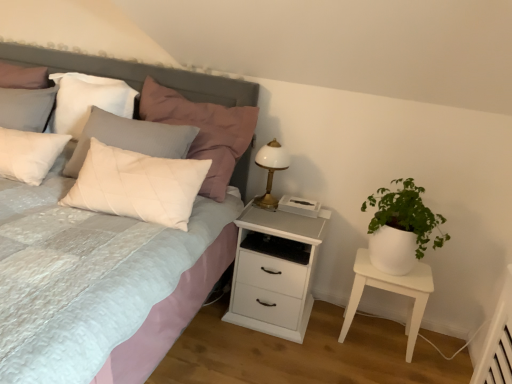
At what (x,y) coordinates should I click in order to perform the action: click on free space between white matte nightstand at center and white matte table at right. Please return your answer as a coordinate pair (x, y). The width and height of the screenshot is (512, 384). Looking at the image, I should click on (335, 334).